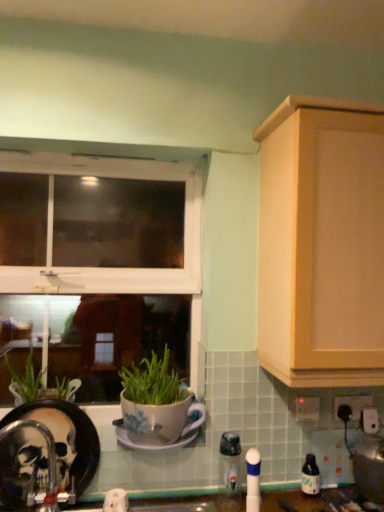
Question: Looking at their shapes, would you say white plastic window at upper left is wider or thinner than white ceramic saucer at center?

Choices:
 (A) thin
 (B) wide

Answer: (A)

Question: Based on their positions, is white plastic window at upper left located to the left or right of white ceramic saucer at center?

Choices:
 (A) left
 (B) right

Answer: (A)

Question: Based on their relative distances, which object is farther from the brushed metal faucet at lower left?

Choices:
 (A) metallic silver toaster at lower right, placed as the 2th appliance when sorted from left to right
 (B) green matte plant pot at left
 (C) white plastic electric outlet at lower right, the 1th electric outlet when ordered from right to left
 (D) light wood cabinet at upper right
 (E) transparent plastic bottle at lower right

Answer: (C)

Question: Which object is positioned closest to the metallic silver toaster at lower right, placed as the 2th appliance when sorted from left to right?

Choices:
 (A) white plastic window at upper left
 (B) white ceramic saucer at center
 (C) light wood cabinet at upper right
 (D) white plastic electric outlet at lower right, the 1th electric outlet when ordered from right to left
 (E) green matte plant pot at left

Answer: (D)